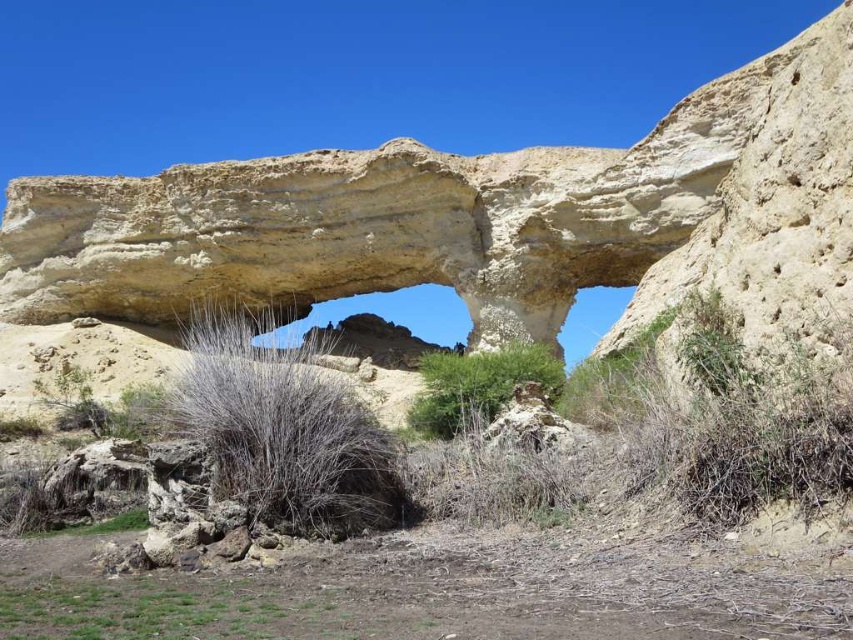
Can you confirm if dry grass at center is positioned to the right of green leafy bush at center?

Incorrect, dry grass at center is not on the right side of green leafy bush at center.

Who is positioned more to the left, dry grass at center or green leafy bush at center?

dry grass at center

Between point (306, 397) and point (550, 396), which one is positioned in front?

Positioned in front is point (306, 397).

The image size is (853, 640). What are the coordinates of `dry grass at center` in the screenshot? It's located at (282, 429).

Between matte sandstone rock arch at center and green leafy bush at center, which one has more height?

With more height is matte sandstone rock arch at center.

What are the coordinates of `matte sandstone rock arch at center` in the screenshot? It's located at (439, 220).

Between matte sandstone rock arch at center and dry grass at center, which one has less height?

dry grass at center is shorter.

Is point (370, 173) positioned behind point (396, 513)?

Yes.

Is point (115, 182) positioned in front of point (234, 451)?

No.

Locate an element on the screen. matte sandstone rock arch at center is located at coordinates (439, 220).